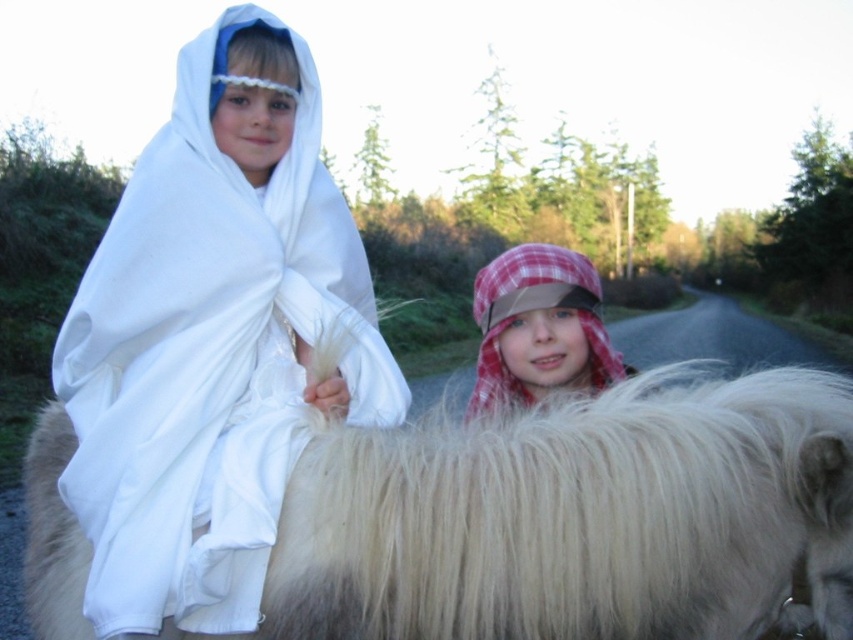
Does white cloth at upper left have a greater height compared to plaid fabric hat at center?

Correct, white cloth at upper left is much taller as plaid fabric hat at center.

Does point (339, 225) come farther from viewer compared to point (538, 268)?

That is False.

Measure the distance between point (102, 326) and camera.

Point (102, 326) is 1.94 meters from camera.

Image resolution: width=853 pixels, height=640 pixels. I want to click on white cloth at upper left, so click(x=213, y=339).

Who is more forward, (585, 604) or (492, 381)?

Point (585, 604) is more forward.

Looking at this image, between fluffy white horse at center and plaid fabric hat at center, which one appears on the left side from the viewer's perspective?

fluffy white horse at center is more to the left.

Does point (358, 461) come farther from viewer compared to point (538, 298)?

No, it is in front of (538, 298).

At what (x,y) coordinates should I click in order to perform the action: click on fluffy white horse at center. Please return your answer as a coordinate pair (x, y). This screenshot has width=853, height=640. Looking at the image, I should click on (576, 516).

Which of these two, fluffy white horse at center or white cloth at upper left, stands shorter?

With less height is fluffy white horse at center.

This screenshot has width=853, height=640. I want to click on fluffy white horse at center, so click(576, 516).